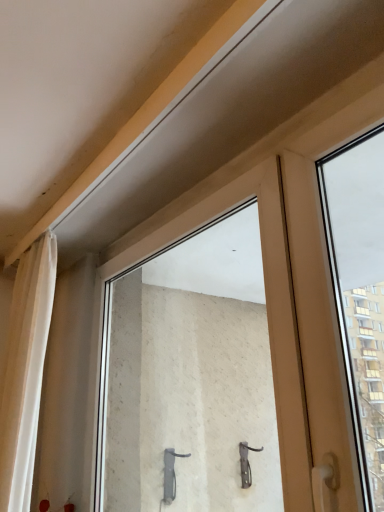
Where is `transparent glass window at center`? The width and height of the screenshot is (384, 512). transparent glass window at center is located at coordinates (267, 310).

The image size is (384, 512). What do you see at coordinates (267, 310) in the screenshot?
I see `transparent glass window at center` at bounding box center [267, 310].

The height and width of the screenshot is (512, 384). What do you see at coordinates (25, 371) in the screenshot? I see `white sheer curtain at left` at bounding box center [25, 371].

What are the coordinates of `white sheer curtain at left` in the screenshot? It's located at (25, 371).

Locate an element on the screen. The height and width of the screenshot is (512, 384). transparent glass window at center is located at coordinates (267, 310).

Between white sheer curtain at left and transparent glass window at center, which one appears on the left side from the viewer's perspective?

white sheer curtain at left is more to the left.

Is white sheer curtain at left positioned before transparent glass window at center?

No, it is not.

Is point (28, 452) behind point (271, 307)?

That is True.

From the image's perspective, is white sheer curtain at left located above or below transparent glass window at center?

From the image's perspective, white sheer curtain at left appears below transparent glass window at center.

From a real-world perspective, is white sheer curtain at left under transparent glass window at center?

No.

Can you confirm if white sheer curtain at left is thinner than transparent glass window at center?

In fact, white sheer curtain at left might be wider than transparent glass window at center.

Considering the relative sizes of white sheer curtain at left and transparent glass window at center in the image provided, is white sheer curtain at left shorter than transparent glass window at center?

No.

Who is bigger, white sheer curtain at left or transparent glass window at center?

Bigger between the two is transparent glass window at center.

Would you say white sheer curtain at left is outside transparent glass window at center?

Yes, white sheer curtain at left is located beyond the bounds of transparent glass window at center.

Is white sheer curtain at left next to transparent glass window at center?

No, white sheer curtain at left is not touching transparent glass window at center.

Is white sheer curtain at left oriented away from transparent glass window at center?

Yes, transparent glass window at center is at the back of white sheer curtain at left.

How distant is white sheer curtain at left from transparent glass window at center?

23.70 inches.

Locate an element on the screen. curtain behind the transparent glass window at center is located at coordinates (25, 371).

Can you confirm if transparent glass window at center is positioned to the right of white sheer curtain at left?

Yes, transparent glass window at center is to the right of white sheer curtain at left.

Relative to white sheer curtain at left, is transparent glass window at center in front or behind?

In the image, transparent glass window at center appears in front of white sheer curtain at left.

Between point (307, 413) and point (38, 397), which one is positioned behind?

Positioned behind is point (38, 397).

From the image's perspective, would you say transparent glass window at center is shown under white sheer curtain at left?

Actually, transparent glass window at center appears above white sheer curtain at left in the image.

From a real-world perspective, is transparent glass window at center physically located above or below white sheer curtain at left?

transparent glass window at center is below white sheer curtain at left.

Considering the sizes of objects transparent glass window at center and white sheer curtain at left in the image provided, who is wider, transparent glass window at center or white sheer curtain at left?

With larger width is white sheer curtain at left.

Considering the sizes of objects transparent glass window at center and white sheer curtain at left in the image provided, who is taller, transparent glass window at center or white sheer curtain at left?

white sheer curtain at left.

Is transparent glass window at center bigger or smaller than white sheer curtain at left?

Considering their sizes, transparent glass window at center takes up more space than white sheer curtain at left.

Which is correct: transparent glass window at center is inside white sheer curtain at left, or outside of it?

transparent glass window at center is located beyond the bounds of white sheer curtain at left.

Are transparent glass window at center and white sheer curtain at left beside each other?

No, transparent glass window at center is not in contact with white sheer curtain at left.

Is transparent glass window at center facing towards white sheer curtain at left?

Yes.

How different are the orientations of transparent glass window at center and white sheer curtain at left in degrees?

0.317 degrees separate the facing orientations of transparent glass window at center and white sheer curtain at left.

This screenshot has height=512, width=384. I want to click on window above the white sheer curtain at left (from the image's perspective), so click(267, 310).

Where is `curtain behind the transparent glass window at center`? curtain behind the transparent glass window at center is located at coordinates (25, 371).

Locate an element on the screen. Image resolution: width=384 pixels, height=512 pixels. curtain above the transparent glass window at center (from a real-world perspective) is located at coordinates (25, 371).